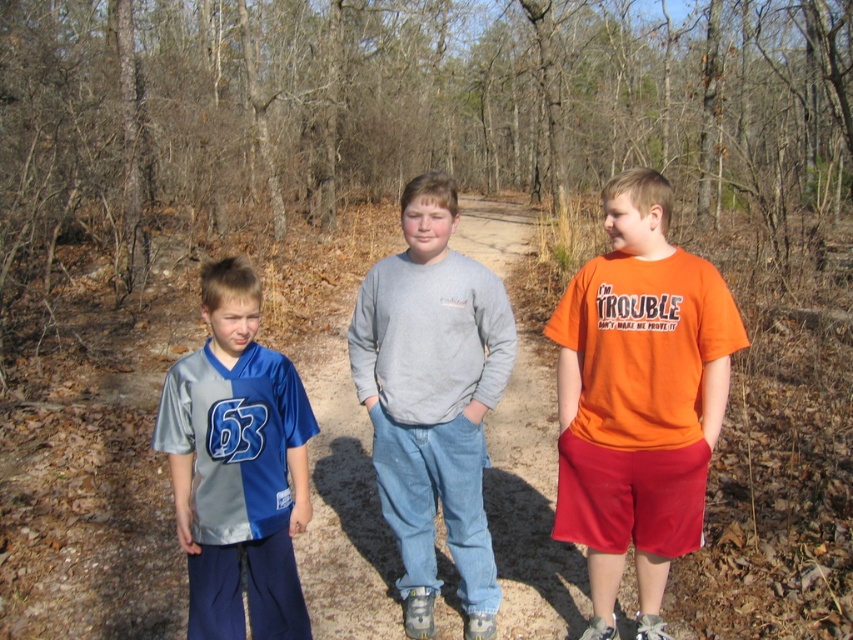
Question: Can you confirm if gray cotton sweatshirt at center is thinner than shiny jersey at center?

Choices:
 (A) no
 (B) yes

Answer: (A)

Question: Which object appears farthest from the camera in this image?

Choices:
 (A) gray cotton sweatshirt at center
 (B) shiny jersey at center
 (C) orange cotton t-shirt at right

Answer: (A)

Question: In this image, where is gray cotton sweatshirt at center located relative to shiny jersey at center?

Choices:
 (A) left
 (B) right

Answer: (B)

Question: Which point appears farthest from the camera in this image?

Choices:
 (A) (405, 452)
 (B) (256, 573)
 (C) (641, 202)

Answer: (A)

Question: Is orange cotton t-shirt at right positioned at the back of gray cotton sweatshirt at center?

Choices:
 (A) yes
 (B) no

Answer: (B)

Question: Which point is closer to the camera taking this photo?

Choices:
 (A) (491, 349)
 (B) (258, 449)

Answer: (B)